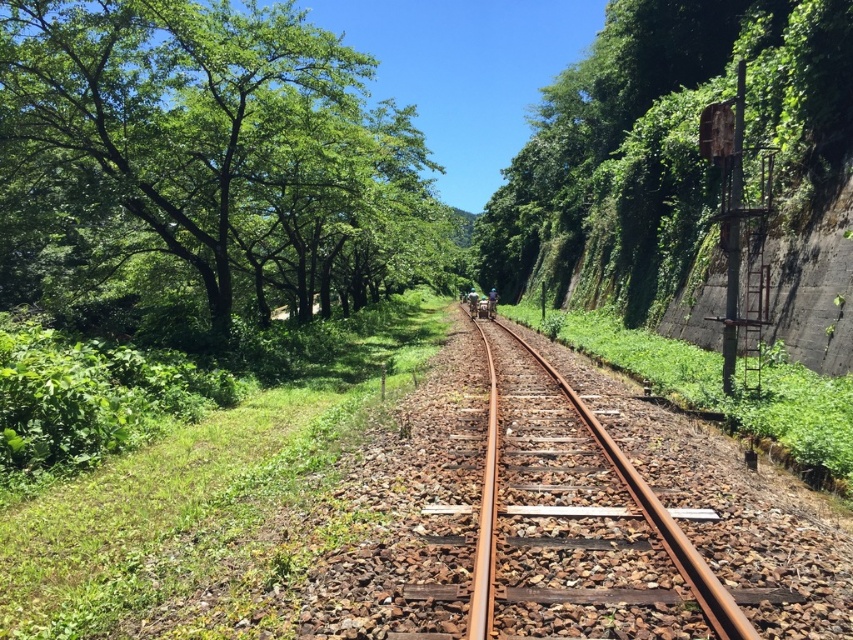
Question: Which of the following is the closest to the observer?

Choices:
 (A) green leafy trees at upper left
 (B) green leafy tree at right
 (C) rusty metal train track at center

Answer: (C)

Question: Does green leafy trees at upper left have a greater width compared to rusty metal train track at center?

Choices:
 (A) no
 (B) yes

Answer: (B)

Question: Can you confirm if green leafy trees at upper left is positioned to the left of green leafy tree at right?

Choices:
 (A) no
 (B) yes

Answer: (B)

Question: Estimate the real-world distances between objects in this image. Which object is farther from the rusty metal train track at center?

Choices:
 (A) green leafy tree at right
 (B) green leafy trees at upper left

Answer: (A)

Question: From the image, what is the correct spatial relationship of green leafy tree at right in relation to rusty metal train track at center?

Choices:
 (A) right
 (B) left

Answer: (A)

Question: Which point is closer to the camera?

Choices:
 (A) green leafy trees at upper left
 (B) rusty metal train track at center
 (C) green leafy tree at right

Answer: (B)